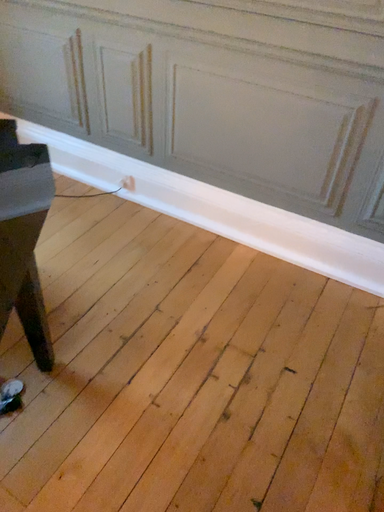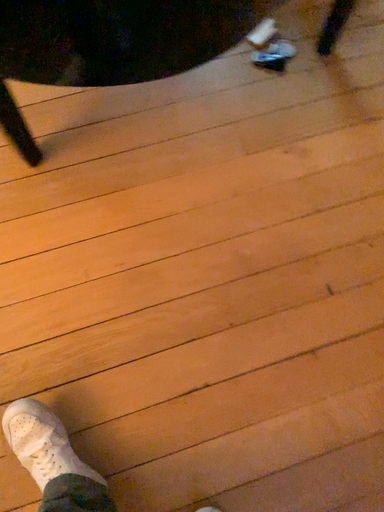
Question: Which way did the camera rotate in the video?

Choices:
 (A) rotated right
 (B) rotated left

Answer: (B)